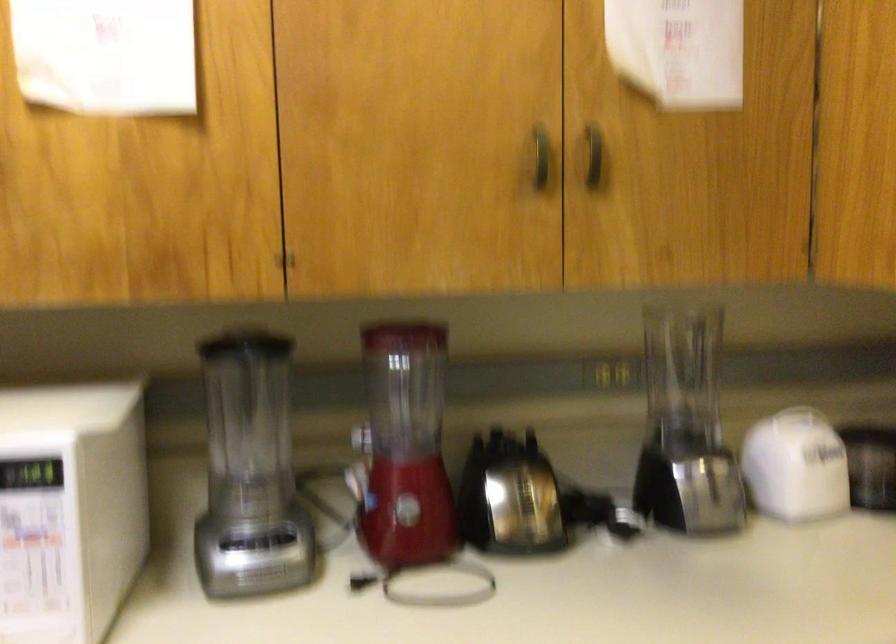
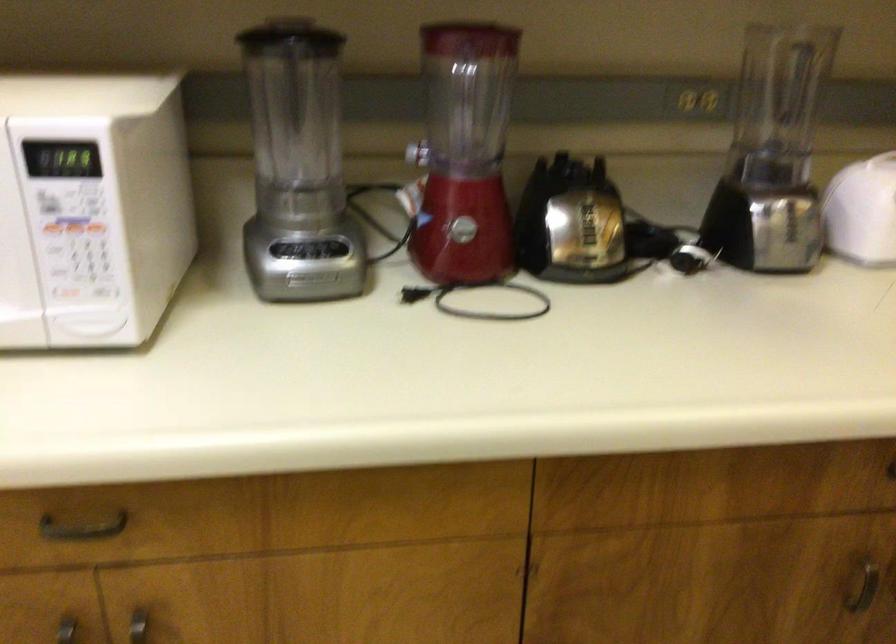
In the second image, find the point that corresponds to the point at 521,504 in the first image.

(580, 225)